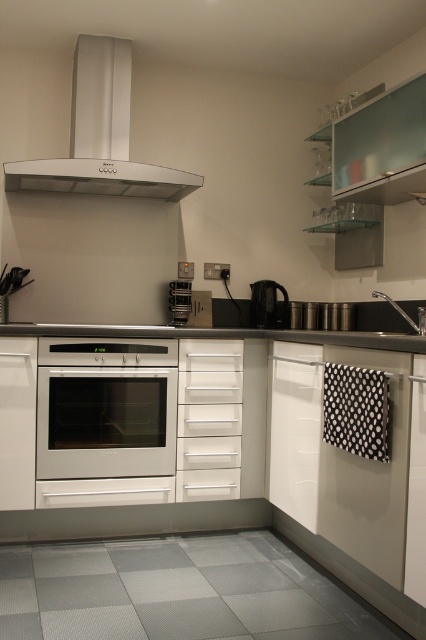
You are standing in the modern kitchen and need to locate the white matte drawer at center. According to the spatial description, where exactly is it positioned?

The white matte drawer at center is located at point (209, 419).